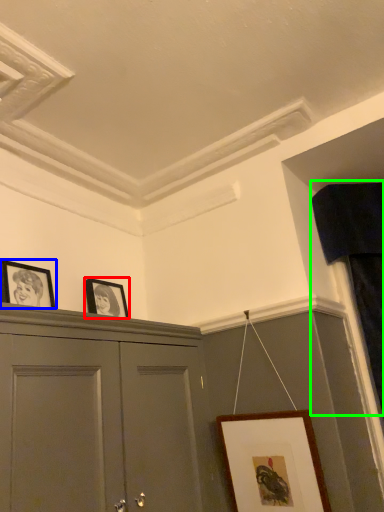
Question: Based on their relative distances, which object is nearer to picture frame (highlighted by a red box)? Choose from picture frame (highlighted by a blue box) and curtain (highlighted by a green box).

Choices:
 (A) picture frame
 (B) curtain

Answer: (A)